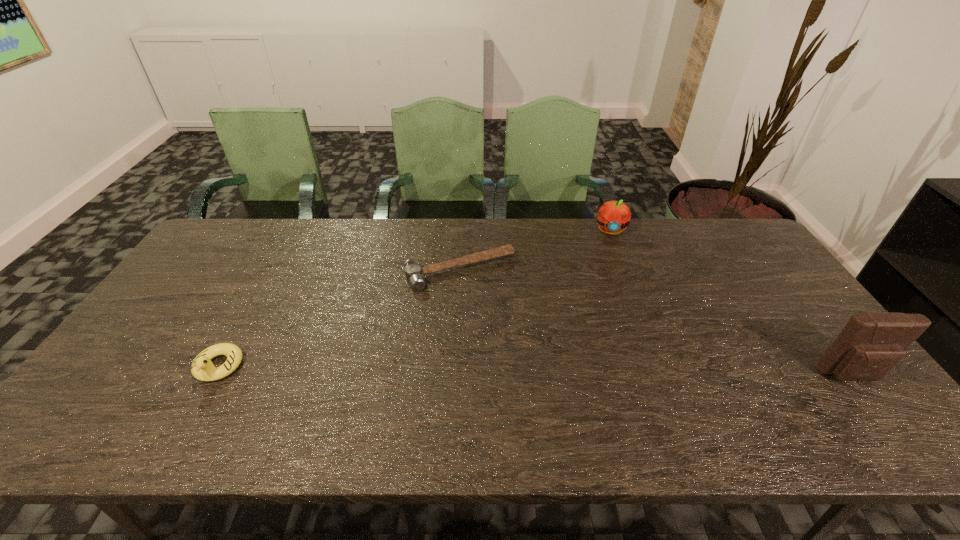
Locate an element on the screen. This screenshot has width=960, height=540. vacant space on the desktop that is between the leftmost object and the tallest object and is positioned on the striking face of the third nearest object is located at coordinates (516, 371).

Locate an element on the screen. vacant spot on the desktop that is between the duckling and the rightmost object and is positioned on the surface of the second object from right to left is located at coordinates [613, 372].